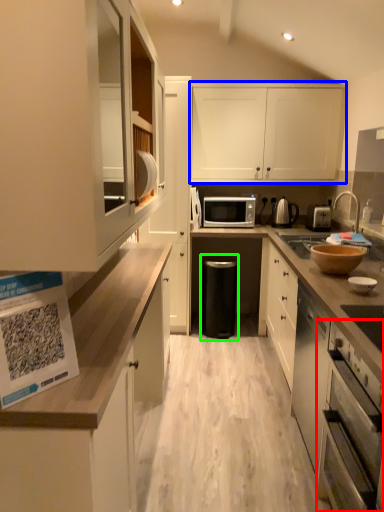
Question: Which is nearer to the oven (highlighted by a red box)? cabinetry (highlighted by a blue box) or dish washer (highlighted by a green box).

Choices:
 (A) cabinetry
 (B) dish washer

Answer: (B)